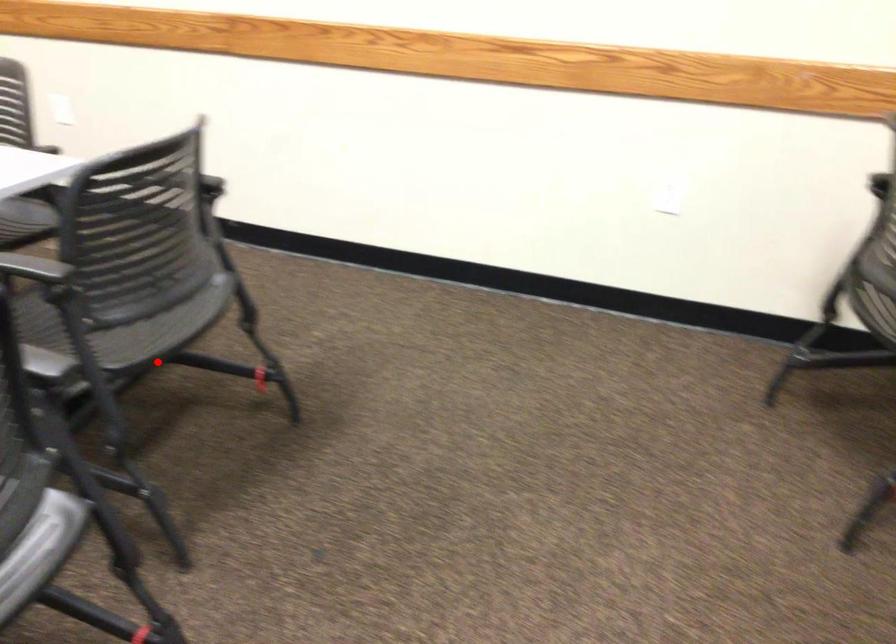
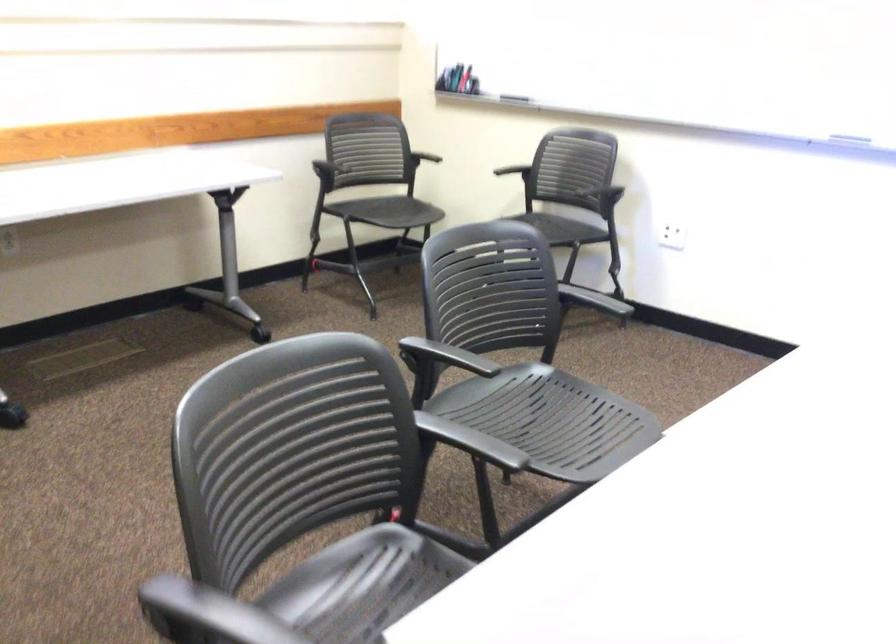
Question: I am providing you with two images of the same scene from different viewpoints. Given a red point in image1, look at the same physical point in image2. Is it:

Choices:
 (A) Closer to the viewpoint
 (B) Farther from the viewpoint

Answer: (A)